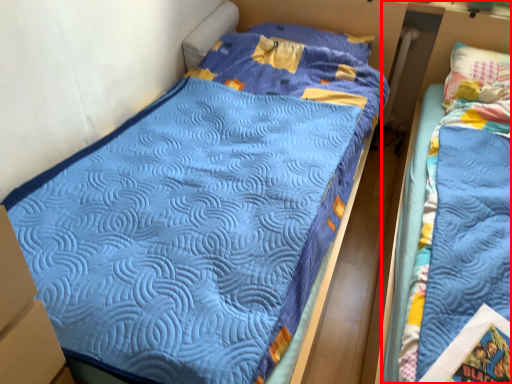
Question: In this image, where is bed (annotated by the red box) located relative to pillow?

Choices:
 (A) left
 (B) right

Answer: (B)